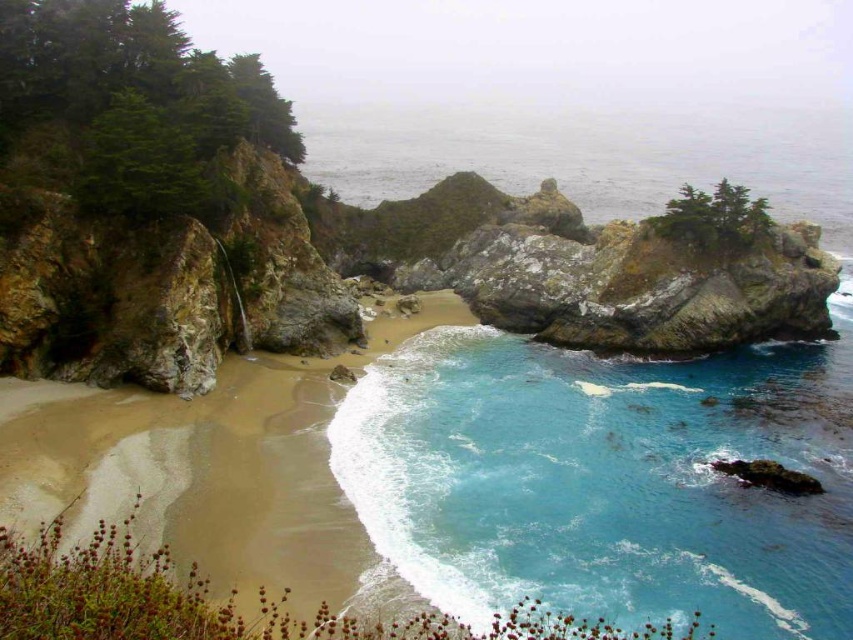
Question: Is blue smooth water at center smaller than sandy beach at center?

Choices:
 (A) yes
 (B) no

Answer: (B)

Question: Among these points, which one is farthest from the camera?

Choices:
 (A) (312, 522)
 (B) (479, 339)

Answer: (B)

Question: Is blue smooth water at center wider than sandy beach at center?

Choices:
 (A) yes
 (B) no

Answer: (A)

Question: Which point appears farthest from the camera in this image?

Choices:
 (A) (724, 374)
 (B) (436, 305)

Answer: (B)

Question: Is blue smooth water at center above sandy beach at center?

Choices:
 (A) no
 (B) yes

Answer: (A)